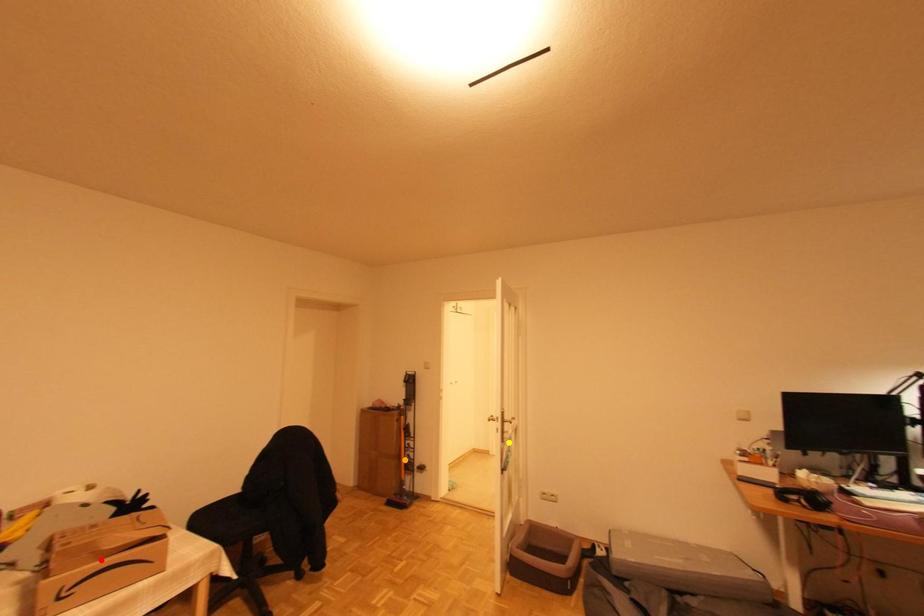
Order these from nearest to farthest:
- orange point
- red point
- yellow point

red point < yellow point < orange point